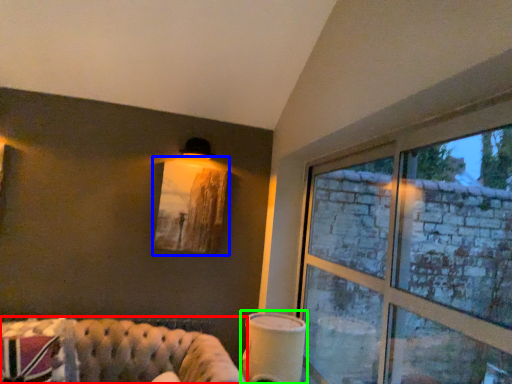
Question: Considering the real-world distances, which object is farthest from studio couch (highlighted by a red box)? picture frame (highlighted by a blue box) or table lamp (highlighted by a green box)?

Choices:
 (A) picture frame
 (B) table lamp

Answer: (A)